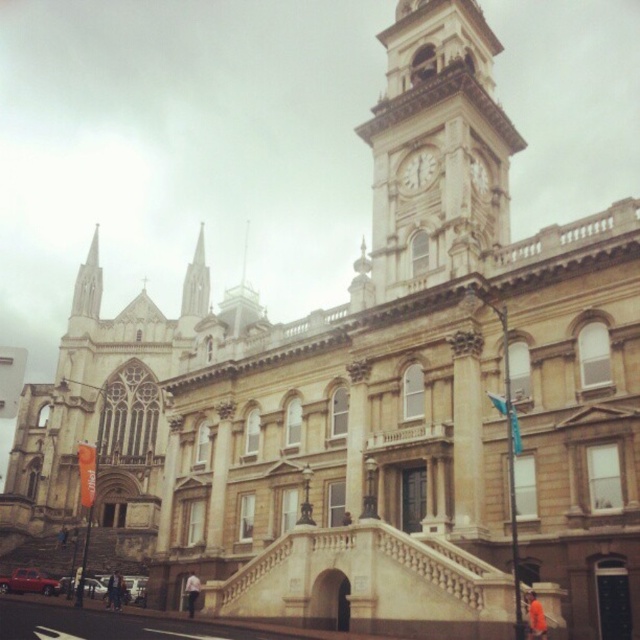
Question: Can you confirm if matte gold clock at upper center is positioned to the right of matte stone clock at upper center?

Choices:
 (A) no
 (B) yes

Answer: (A)

Question: Observing the image, what is the correct spatial positioning of light brown stone clock tower at upper right in reference to matte gold clock at upper center?

Choices:
 (A) left
 (B) right

Answer: (B)

Question: Which point appears farthest from the camera in this image?

Choices:
 (A) (470, 179)
 (B) (396, 76)
 (C) (426, 152)

Answer: (B)

Question: Which of the following is the closest to the observer?

Choices:
 (A) matte stone clock at upper center
 (B) matte gold clock at upper center
 (C) light brown stone clock tower at upper right

Answer: (C)

Question: Which of the following is the farthest from the observer?

Choices:
 (A) light brown stone clock tower at upper right
 (B) matte stone clock at upper center

Answer: (B)

Question: Can you confirm if matte gold clock at upper center is thinner than matte stone clock at upper center?

Choices:
 (A) no
 (B) yes

Answer: (A)